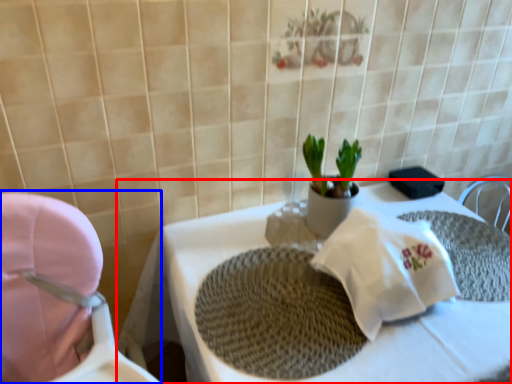
Question: Which object appears farthest to the camera in this image, table (highlighted by a red box) or baby carriage (highlighted by a blue box)?

Choices:
 (A) table
 (B) baby carriage

Answer: (A)